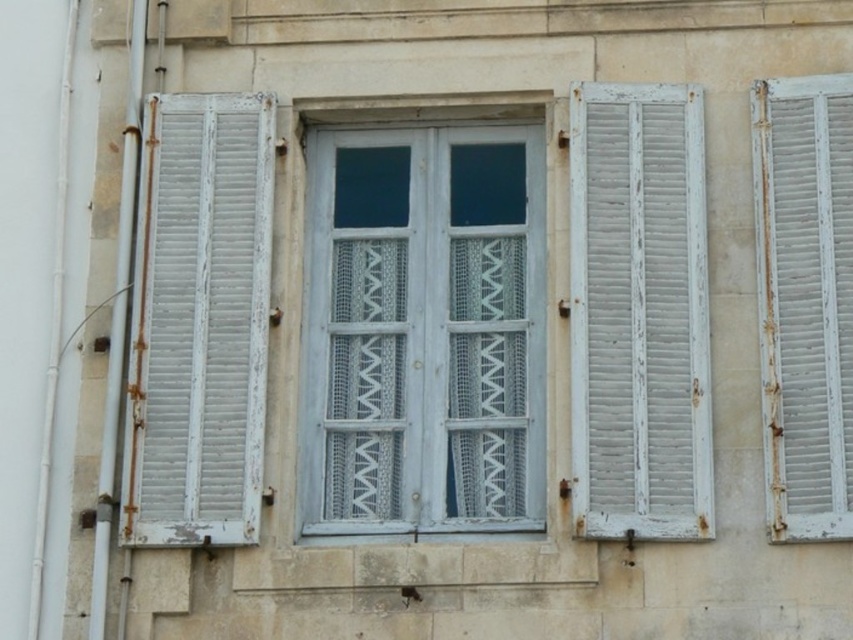
You are an architect inspecting the building facade. You notice the white wooden shutters at right and the white wooden shutter at right. Which one is located lower in the structure?

The white wooden shutters at right is positioned under the white wooden shutter at right, so it is located lower in the structure.

You are standing in front of the building and notice two points marked on the facade. The first point is at coordinate point (x=511, y=529) and the second is at point (x=795, y=413). Which point is closer to you?

Point (x=795, y=413) is closer to you because point (x=511, y=529) is behind it.